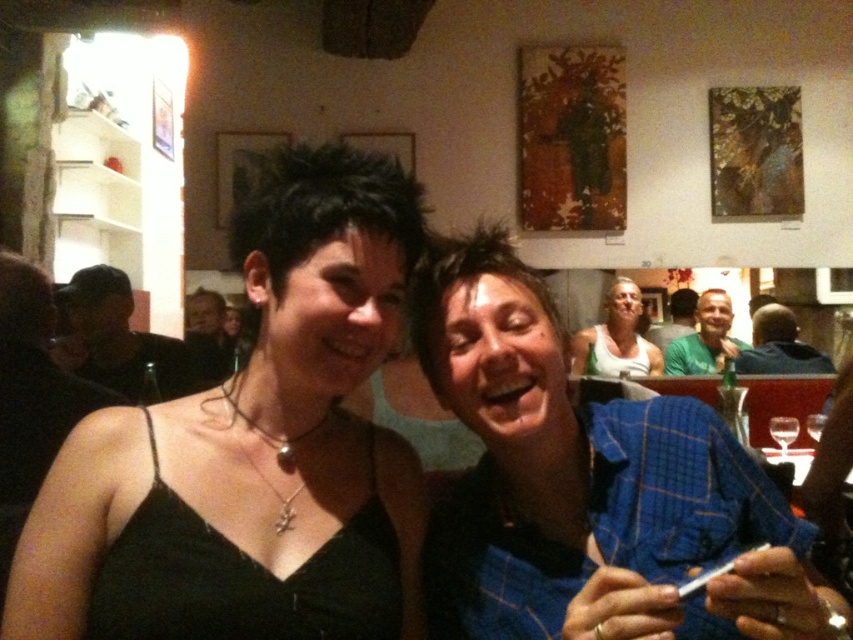
You are at a party and want to find the blue plaid shirt at center and the green shirt at center. Which one is bigger in size?

The blue plaid shirt at center is larger in size than the green shirt at center.

You are a photographer at the event and want to focus on the black satin dress at center without the transparent glass at center appearing in the foreground. Is this possible?

The black satin dress at center is closer to the viewer than the transparent glass at center, so adjusting the camera focus to prioritize the black satin dress at center would allow it to be in focus while the transparent glass at center appears blurred in the background.